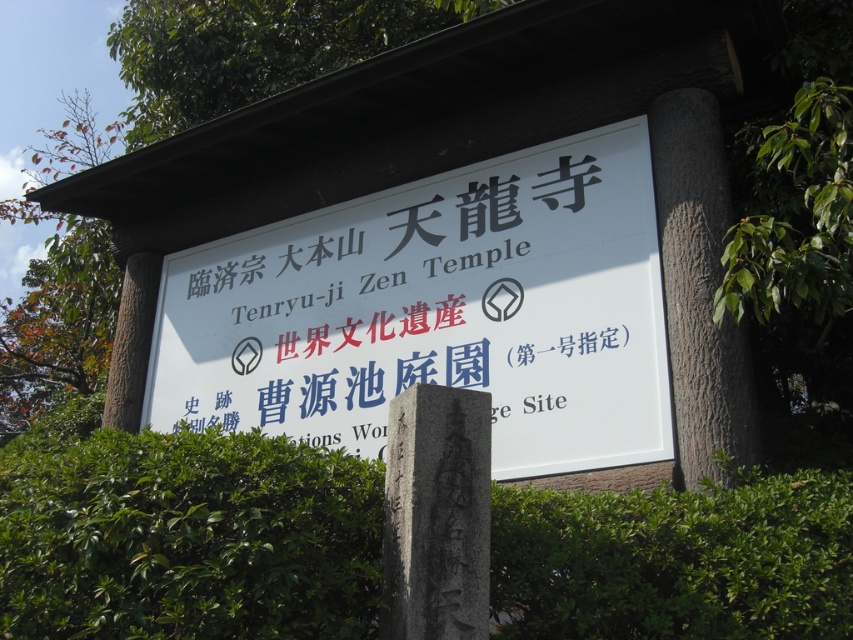
What is the relationship in height between the green leafy hedge at center and the white paper sign at center?

The green leafy hedge at center is not as tall as the white paper sign at center.

You are a tourist holding a camera and want to take a clear photo of the white paper sign at center without any obstruction. Considering the green leafy tree at upper center, what should you do to ensure the sign is visible?

The white paper sign at center is in front of the green leafy tree at upper center, so you should position yourself so the sign is not blocked by the tree. Ensure the camera is angled to capture the sign clearly in front of the tree without any overlapping obstruction.